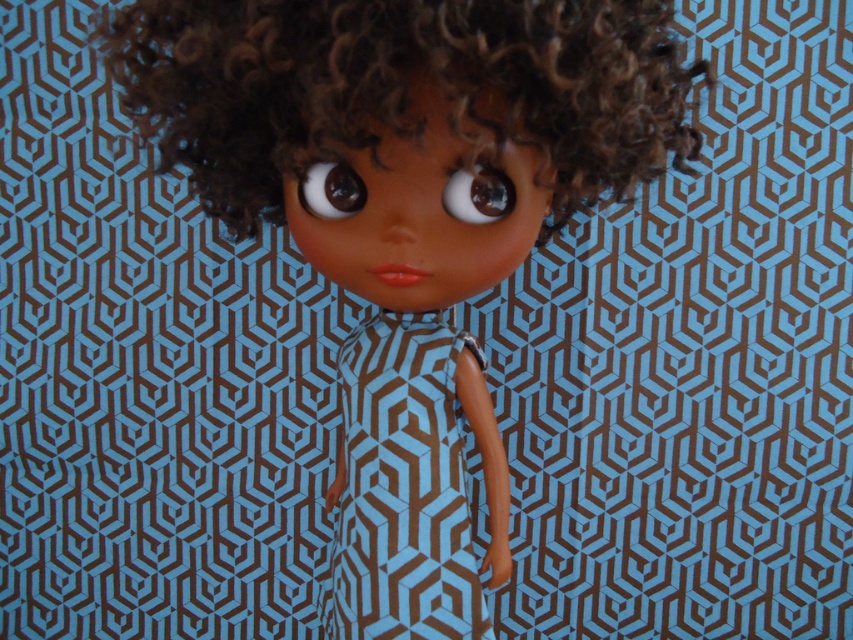
Question: Which object is closer to the camera taking this photo?

Choices:
 (A) blue geometric-patterned dress at center
 (B) matte plastic doll at center
 (C) brown glossy eye at center

Answer: (B)

Question: Can you confirm if blue geometric-patterned dress at center is thinner than shiny brown eye at center?

Choices:
 (A) yes
 (B) no

Answer: (B)

Question: Is matte plastic doll at center to the left of brown curly hair at center from the viewer's perspective?

Choices:
 (A) yes
 (B) no

Answer: (A)

Question: Which of the following is the farthest from the observer?

Choices:
 (A) (335, 196)
 (B) (105, 49)
 (C) (363, 16)

Answer: (B)

Question: Is matte plastic doll at center positioned in front of shiny brown eye at center?

Choices:
 (A) no
 (B) yes

Answer: (B)

Question: Based on their relative distances, which object is nearer to the shiny brown eye at center?

Choices:
 (A) brown curly hair at center
 (B) brown glossy eye at center
 (C) blue geometric-patterned dress at center
 (D) matte plastic doll at center

Answer: (B)